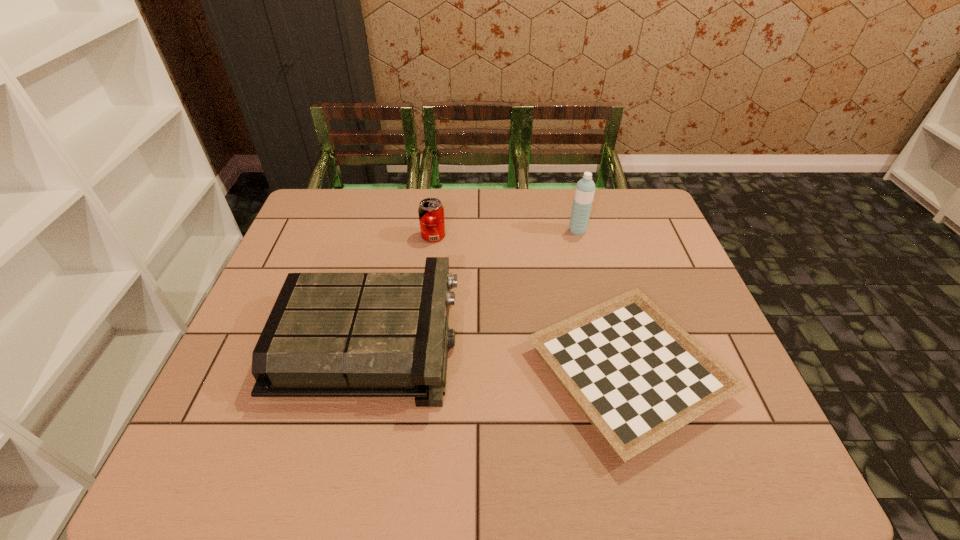
Where is `object that is the closest to the radio receiver`? The height and width of the screenshot is (540, 960). object that is the closest to the radio receiver is located at coordinates (637, 376).

Image resolution: width=960 pixels, height=540 pixels. I want to click on free spot that satisfies the following two spatial constraints: 1. on the back side of the water bottle; 2. on the left side of the soda can, so click(x=434, y=231).

You are a GUI agent. You are given a task and a screenshot of the screen. Output one action in this format:
    pyautogui.click(x=<x>, y=<y>)
    Task: Click on the vacant point that satisfies the following two spatial constraints: 1. on the front panel of the shortest object; 2. on the right side of the radio receiver
    
    Given the screenshot: What is the action you would take?
    [365, 372]

The height and width of the screenshot is (540, 960). What are the coordinates of `vacant space that satisfies the following two spatial constraints: 1. on the back side of the water bottle; 2. on the left side of the soda can` in the screenshot? It's located at (434, 231).

Where is `blank area in the image that satisfies the following two spatial constraints: 1. on the front side of the soda can; 2. on the left side of the checkerboard`? Image resolution: width=960 pixels, height=540 pixels. blank area in the image that satisfies the following two spatial constraints: 1. on the front side of the soda can; 2. on the left side of the checkerboard is located at coordinates (417, 372).

Identify the location of free location that satisfies the following two spatial constraints: 1. on the front panel of the radio receiver; 2. on the left side of the checkerboard. The image size is (960, 540). (365, 372).

The height and width of the screenshot is (540, 960). Find the location of `free location that satisfies the following two spatial constraints: 1. on the front side of the soda can; 2. on the left side of the shortest object`. free location that satisfies the following two spatial constraints: 1. on the front side of the soda can; 2. on the left side of the shortest object is located at coordinates pyautogui.click(x=417, y=372).

Where is `free space that satisfies the following two spatial constraints: 1. on the front panel of the radio receiver; 2. on the right side of the shortest object`? free space that satisfies the following two spatial constraints: 1. on the front panel of the radio receiver; 2. on the right side of the shortest object is located at coordinates (365, 372).

The image size is (960, 540). What are the coordinates of `blank area in the image that satisfies the following two spatial constraints: 1. on the front panel of the radio receiver; 2. on the left side of the checkerboard` in the screenshot? It's located at (365, 372).